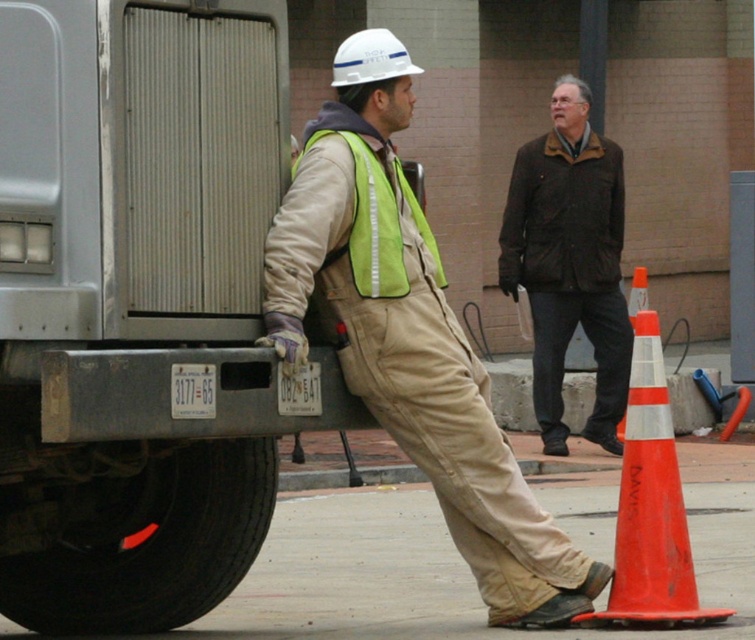
Is the position of brushed metal trailer truck at left less distant than that of brown woolen jacket at upper center?

Yes, it is in front of brown woolen jacket at upper center.

Between brushed metal trailer truck at left and brown woolen jacket at upper center, which one has less height?

brushed metal trailer truck at left is shorter.

Locate an element on the screen. This screenshot has width=755, height=640. brushed metal trailer truck at left is located at coordinates (131, 296).

This screenshot has width=755, height=640. Find the location of `brushed metal trailer truck at left`. brushed metal trailer truck at left is located at coordinates pos(131,296).

Does matte khaki overalls at center have a smaller size compared to orange plastic traffic cone at lower right?

Incorrect, matte khaki overalls at center is not smaller in size than orange plastic traffic cone at lower right.

Is point (333, 58) less distant than point (726, 616)?

No, it is not.

Locate an element on the screen. The width and height of the screenshot is (755, 640). matte khaki overalls at center is located at coordinates pyautogui.click(x=408, y=337).

Measure the distance from brushed metal trailer truck at left to black rubber tire at lower left.

brushed metal trailer truck at left and black rubber tire at lower left are 1.40 meters apart from each other.

Describe the element at coordinates (131, 296) in the screenshot. The height and width of the screenshot is (640, 755). I see `brushed metal trailer truck at left` at that location.

Measure the distance between brushed metal trailer truck at left and camera.

5.79 meters

Locate an element on the screen. brushed metal trailer truck at left is located at coordinates (131, 296).